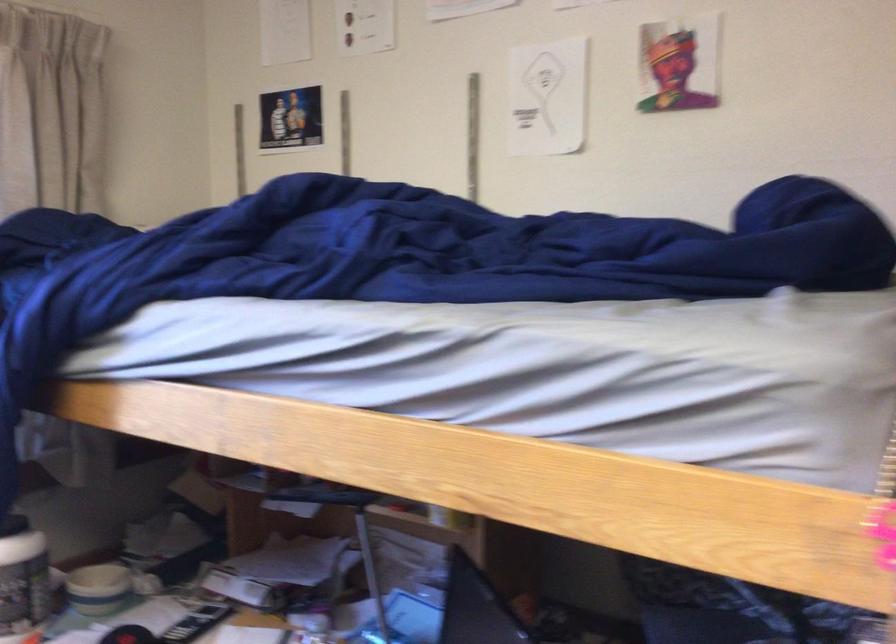
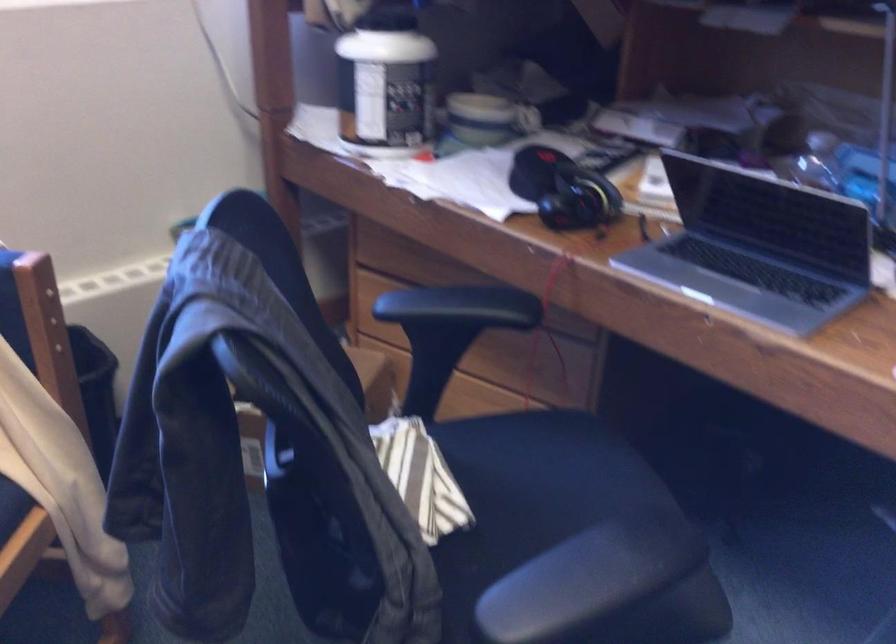
The images are taken continuously from a first-person perspective. In which direction are you moving?

The movement direction of the cameraman is left, forward.